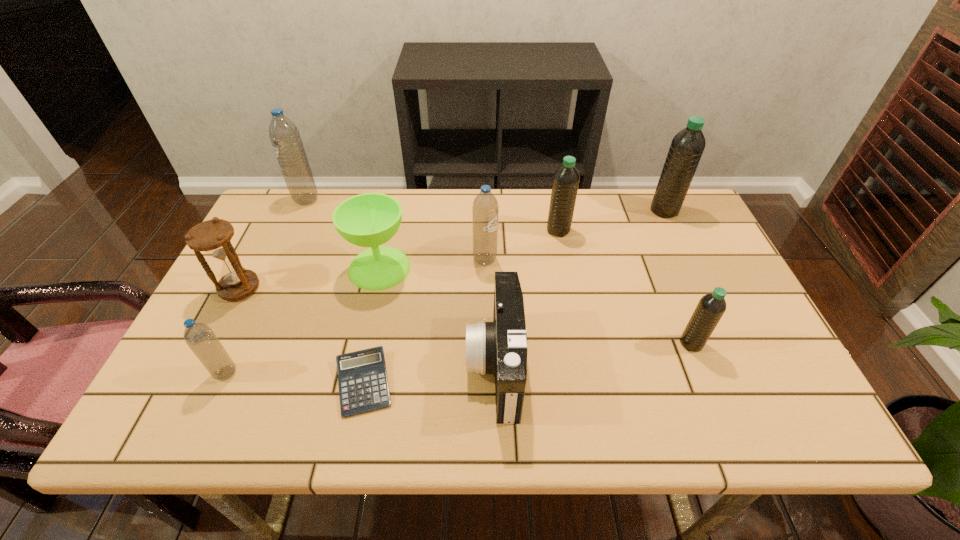
Locate an element on the screen. This screenshot has width=960, height=540. empty space that is in between the camcorder and the hourglass is located at coordinates (368, 327).

You are a GUI agent. You are given a task and a screenshot of the screen. Output one action in this format:
    pyautogui.click(x=<x>, y=<y>)
    Task: Click on the free space between the camcorder and the second water bottle from right to left
    The image size is (960, 540).
    Given the screenshot: What is the action you would take?
    pyautogui.click(x=593, y=355)

Image resolution: width=960 pixels, height=540 pixels. In order to click on free area in between the calculator and the hourglass in this screenshot , I will do pyautogui.click(x=301, y=336).

The width and height of the screenshot is (960, 540). Identify the location of free spot between the calculator and the black camcorder. (429, 375).

Locate an element on the screen. empty location between the fourth nearest water bottle and the rightmost blue water bottle is located at coordinates (521, 245).

Identify the location of vacant point located between the nearest water bottle and the second farthest black water bottle. (392, 302).

I want to click on free space between the nearest blue water bottle and the green wineglass, so click(x=302, y=321).

Identify the location of empty location between the black camcorder and the hourglass. The height and width of the screenshot is (540, 960). (368, 327).

Locate an element on the screen. free space between the rightmost object and the black camcorder is located at coordinates (580, 288).

Locate which object is the second closest to the shortest object. Please provide its 2D coordinates. Your answer should be formatted as a tuple, i.e. [(x, y)], where the tuple contains the x and y coordinates of a point satisfying the conditions above.

[(371, 219)]